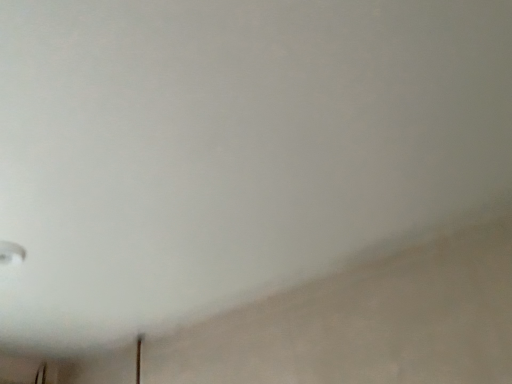
This screenshot has height=384, width=512. I want to click on white matte parachute at lower left, so click(11, 253).

In order to face white matte parachute at lower left, should I rotate leftwards or rightwards?

You should rotate left by 30.714 degrees.

The width and height of the screenshot is (512, 384). Describe the element at coordinates (11, 253) in the screenshot. I see `white matte parachute at lower left` at that location.

Identify the location of white matte parachute at lower left. The width and height of the screenshot is (512, 384). (11, 253).